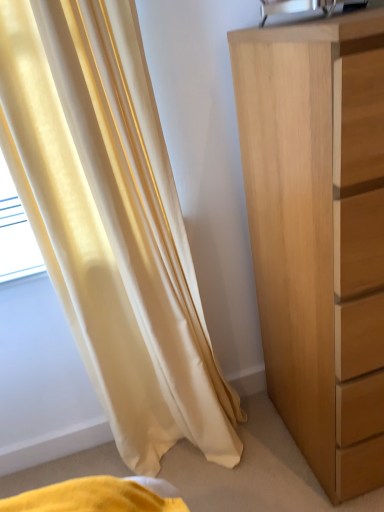
Question: From the image's perspective, is satin yellow curtain at left below light brown wood chest of drawers at right?

Choices:
 (A) no
 (B) yes

Answer: (B)

Question: From a real-world perspective, is satin yellow curtain at left on light brown wood chest of drawers at right?

Choices:
 (A) yes
 (B) no

Answer: (A)

Question: Is satin yellow curtain at left facing away from light brown wood chest of drawers at right?

Choices:
 (A) yes
 (B) no

Answer: (B)

Question: Can you confirm if satin yellow curtain at left is positioned to the left of light brown wood chest of drawers at right?

Choices:
 (A) no
 (B) yes

Answer: (B)

Question: Is satin yellow curtain at left smaller than light brown wood chest of drawers at right?

Choices:
 (A) no
 (B) yes

Answer: (B)

Question: Considering the relative positions of satin yellow curtain at left and light brown wood chest of drawers at right in the image provided, is satin yellow curtain at left to the right of light brown wood chest of drawers at right from the viewer's perspective?

Choices:
 (A) yes
 (B) no

Answer: (B)

Question: Is light brown wood chest of drawers at right further to the viewer compared to satin yellow curtain at left?

Choices:
 (A) no
 (B) yes

Answer: (A)

Question: Does light brown wood chest of drawers at right have a larger size compared to satin yellow curtain at left?

Choices:
 (A) no
 (B) yes

Answer: (B)

Question: Does light brown wood chest of drawers at right appear on the right side of satin yellow curtain at left?

Choices:
 (A) yes
 (B) no

Answer: (A)

Question: From a real-world perspective, does light brown wood chest of drawers at right stand above satin yellow curtain at left?

Choices:
 (A) no
 (B) yes

Answer: (A)

Question: Does light brown wood chest of drawers at right have a greater width compared to satin yellow curtain at left?

Choices:
 (A) yes
 (B) no

Answer: (A)

Question: From the image's perspective, is light brown wood chest of drawers at right below satin yellow curtain at left?

Choices:
 (A) yes
 (B) no

Answer: (B)

Question: From a real-world perspective, relative to light brown wood chest of drawers at right, is satin yellow curtain at left vertically above or below?

Choices:
 (A) below
 (B) above

Answer: (B)